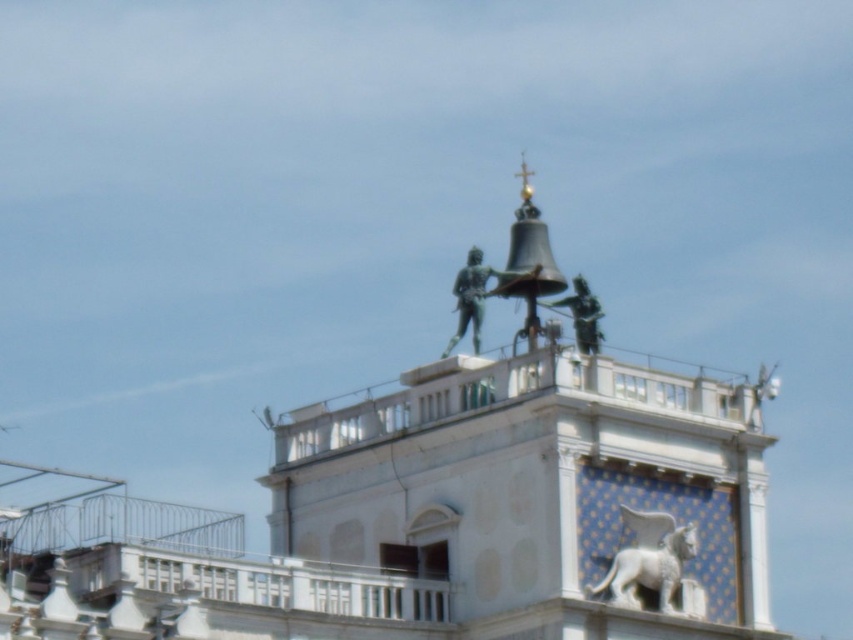
You are an art conservator assessing the statues on the building. You notice both the bronze statue at center and the green patina statue at center. Which statue is closer to the viewer?

The bronze statue at center is closer to the viewer as it is positioned in front of the green patina statue at center.

You are an art student sketching the historic building and notice two statues on the bell tower. The white marble lion at center and the green patina statue at center. Which one is positioned lower on the tower?

The white marble lion at center is positioned lower on the tower than the green patina statue at center.

You are an art student analyzing the statues on the historic building. You notice the white marble lion at center and the green patina statue at center. Which statue is larger in size?

The white marble lion at center is smaller than the green patina statue at center, so the green patina statue at center is larger in size.